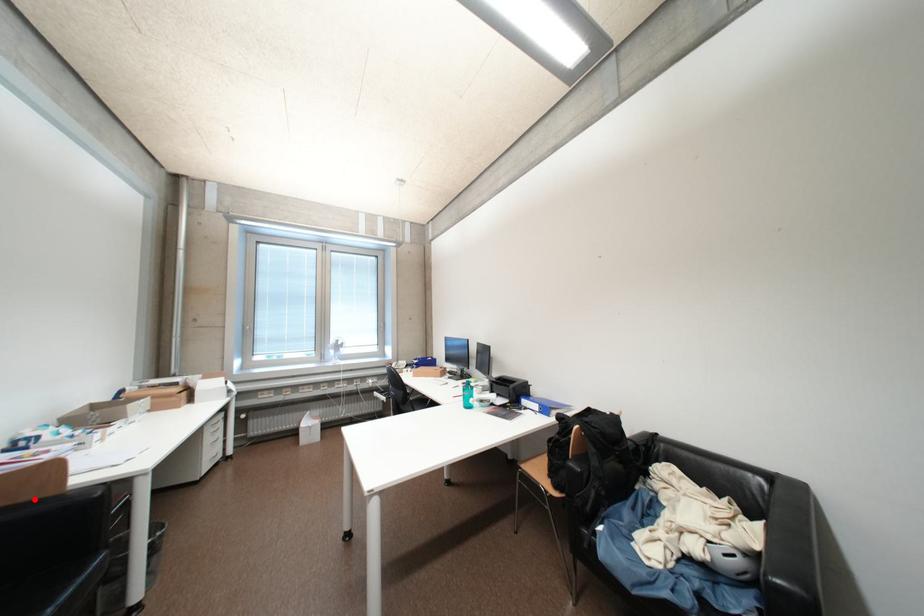
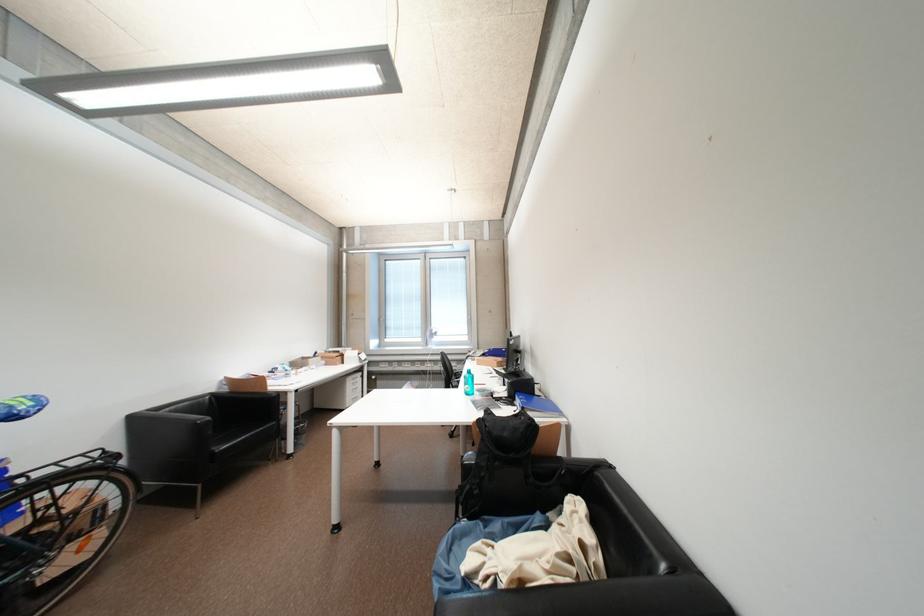
Find the pixel in the second image that matches the highlighted location in the first image.

(264, 392)